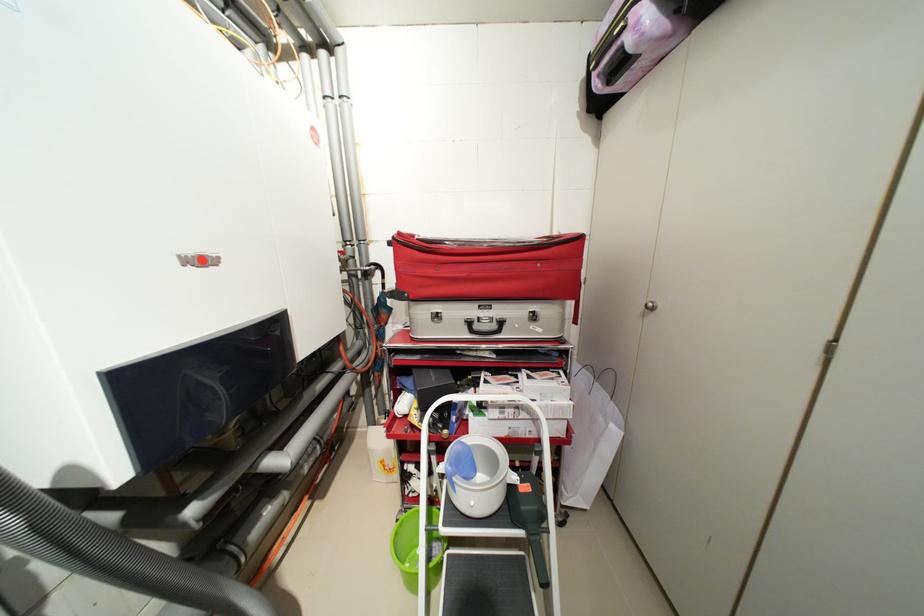
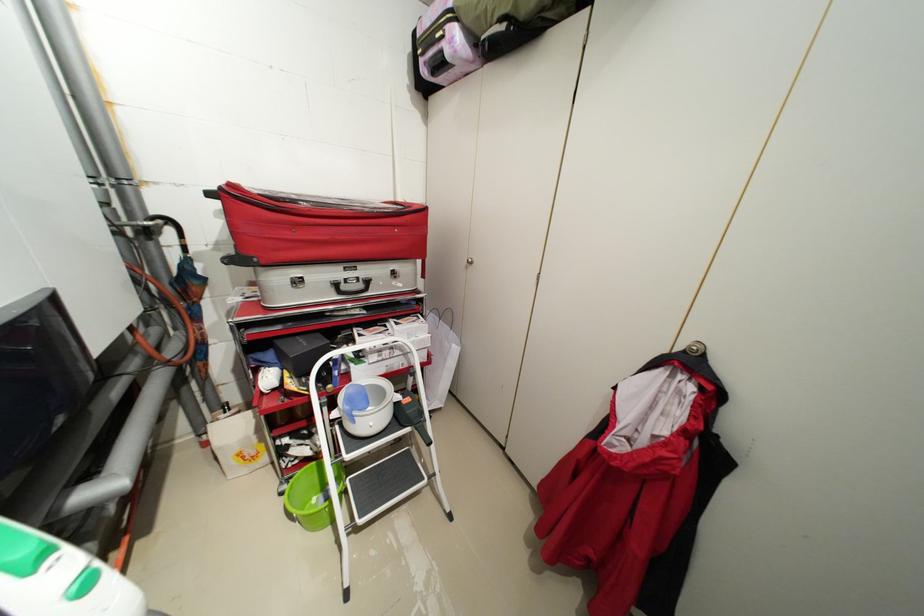
Question: The images are taken continuously from a first-person perspective. In which direction is your viewpoint rotating?

Choices:
 (A) Left
 (B) Right
 (C) Up
 (D) Down

Answer: (B)